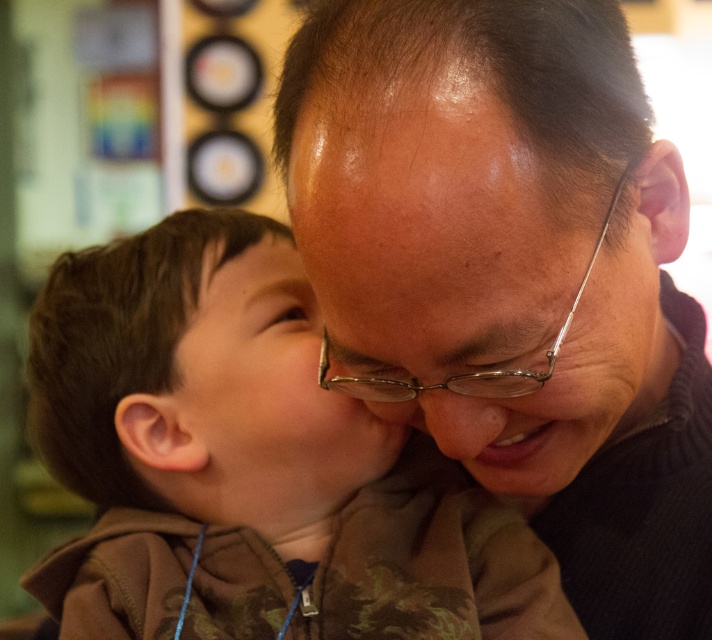
You are a photographer capturing this heartfelt moment between the father and son. You notice the brown camouflage hoodie at center and the matte skin nose at center. Which object is positioned higher in the image?

The brown camouflage hoodie at center is positioned higher than the matte skin nose at center.

In the scene where a father and son are sharing a tender kiss, there is a point marked at coordinates (471, 371). What object is located at this point?

The point at (471, 371) indicates clear plastic glasses at center.

You are a photographer capturing this heartfelt moment. You notice the brown camouflage hoodie at center and the matte skin nose at center. Which object is closer to the camera lens?

The brown camouflage hoodie at center is closer to the camera lens because the matte skin nose at center is behind it.